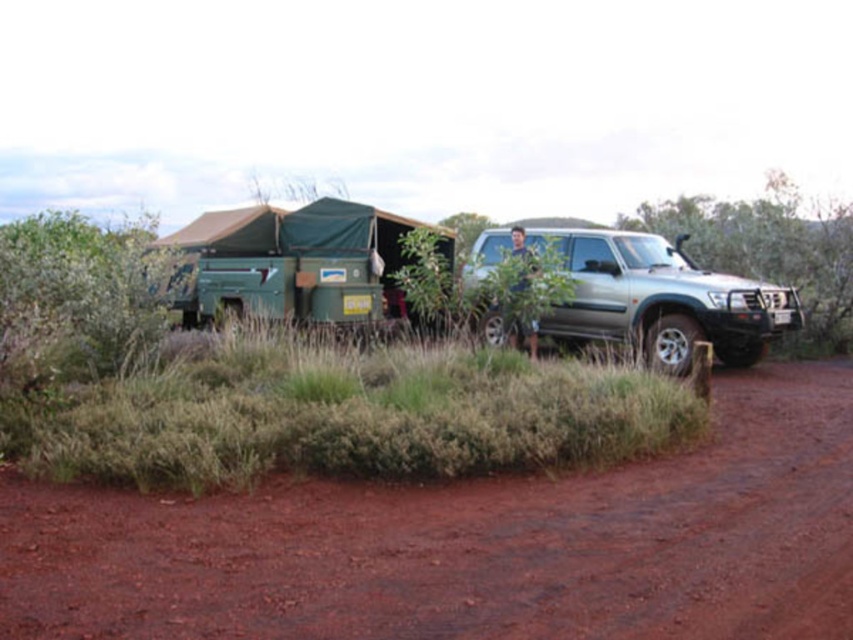
Looking at this image, you are standing at the center of the scene. There is a point marked at coordinates (660, 298). What object is located at that point?

The point at coordinates (660, 298) marks the silver metallic jeep at right.

You are standing at the point with coordinates point (701, 200) and want to walk to the point with coordinates point (728, 484). Which direction should you face to move towards your destination?

You should face forward because point (728, 484) is in front of point (701, 200).

You are planning to drive a car with a width of 1.8 meters along the red clay dirt track at lower center. There is a green leafy bush at right nearby. Based on the scene, can the car safely pass through the track without hitting the bush?

The red clay dirt track at lower center has a lesser width compared to green leafy bush at right. Since the track is narrower than the bush, the car might not have enough space to pass safely. However, without knowing the exact width of the track, it is difficult to determine if 1.8 meters is safe. The answer is inconclusive based on the given information.